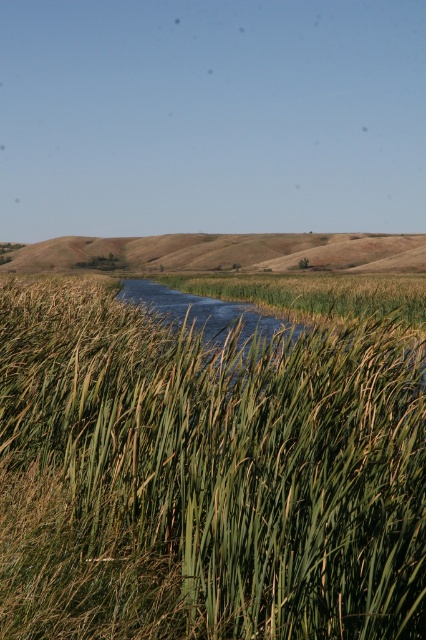
From the picture: Does green grassy at center appear on the right side of brown grassy hillside at center?

Correct, you'll find green grassy at center to the right of brown grassy hillside at center.

Is green grassy at center wider than brown grassy hillside at center?

No, green grassy at center is not wider than brown grassy hillside at center.

Is point (342, 332) positioned after point (339, 260)?

No, it is in front of (339, 260).

This screenshot has height=640, width=426. What are the coordinates of `green grassy at center` in the screenshot? It's located at pos(218,470).